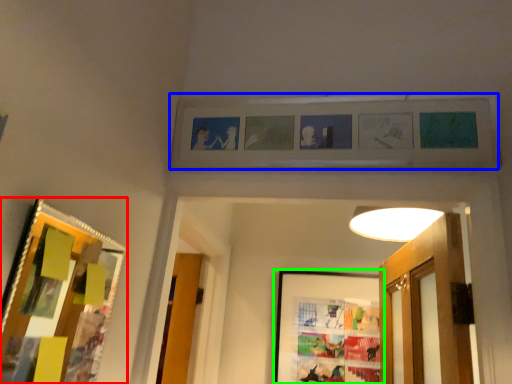
Question: Based on their relative distances, which object is nearer to picture frame (highlighted by a red box)? Choose from picture frame (highlighted by a blue box) and picture frame (highlighted by a green box).

Choices:
 (A) picture frame
 (B) picture frame

Answer: (A)